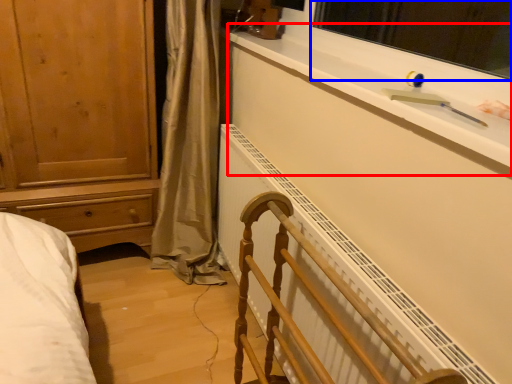
Question: Which object appears closest to the camera in this image, window sill (highlighted by a red box) or window screen (highlighted by a blue box)?

Choices:
 (A) window sill
 (B) window screen

Answer: (A)